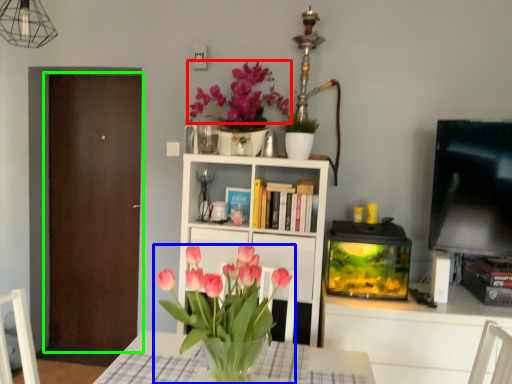
Question: Based on their relative distances, which object is farther from flower (highlighted by a red box)? Choose from houseplant (highlighted by a blue box) and door (highlighted by a green box).

Choices:
 (A) houseplant
 (B) door

Answer: (A)